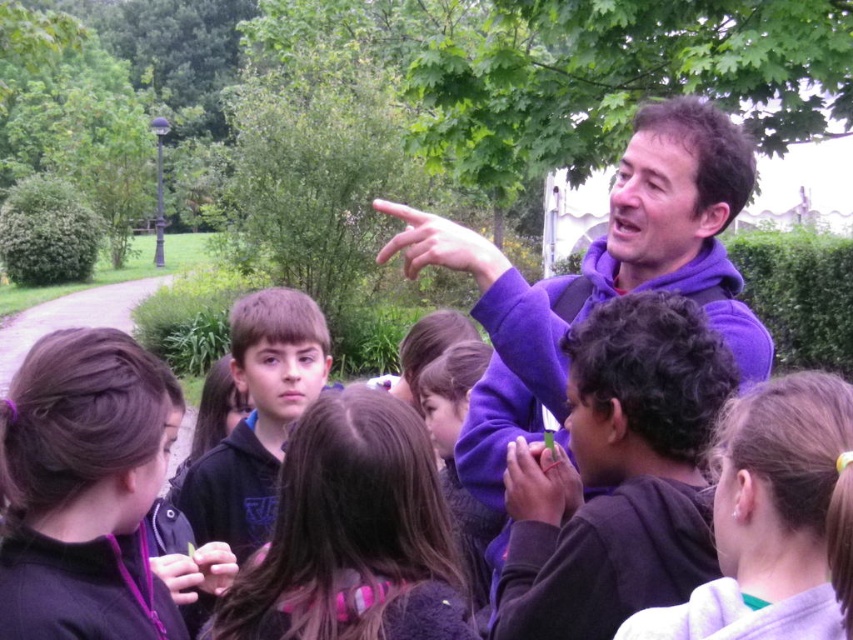
Question: Can you confirm if brown hair at center is positioned above matte purple sweater at center?

Choices:
 (A) no
 (B) yes

Answer: (B)

Question: Which object is farther from the camera taking this photo?

Choices:
 (A) purple hoodie at lower right
 (B) purple fleece jacket at center

Answer: (B)

Question: Which point appears closest to the camera in this image?

Choices:
 (A) (122, 346)
 (B) (509, 509)
 (C) (173, 570)

Answer: (A)

Question: Is brown hair at center further to the viewer compared to matte purple sweater at center?

Choices:
 (A) yes
 (B) no

Answer: (B)

Question: Can you confirm if purple hoodie at lower right is bigger than purple matte hand at center?

Choices:
 (A) yes
 (B) no

Answer: (A)

Question: Which of the following is the farthest from the observer?

Choices:
 (A) purple matte hand at center
 (B) matte purple sweater at center
 (C) purple hoodie at lower right

Answer: (A)